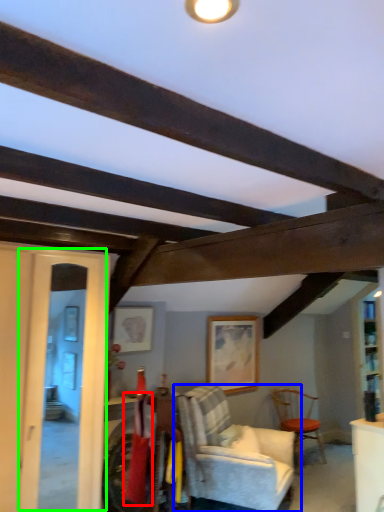
Question: Considering the real-world distances, which object is closest to laundry (highlighted by a red box)? chair (highlighted by a blue box) or glass door (highlighted by a green box).

Choices:
 (A) chair
 (B) glass door

Answer: (B)